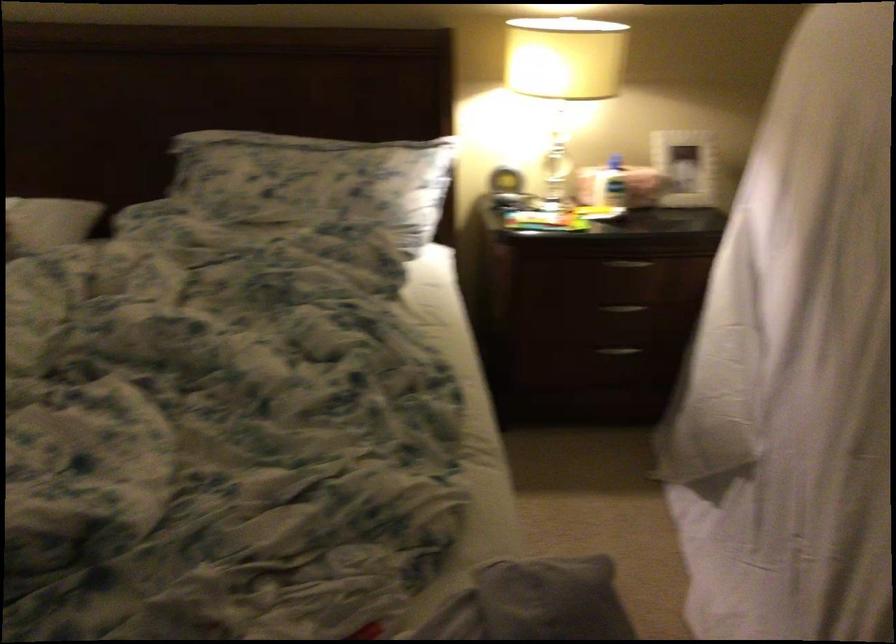
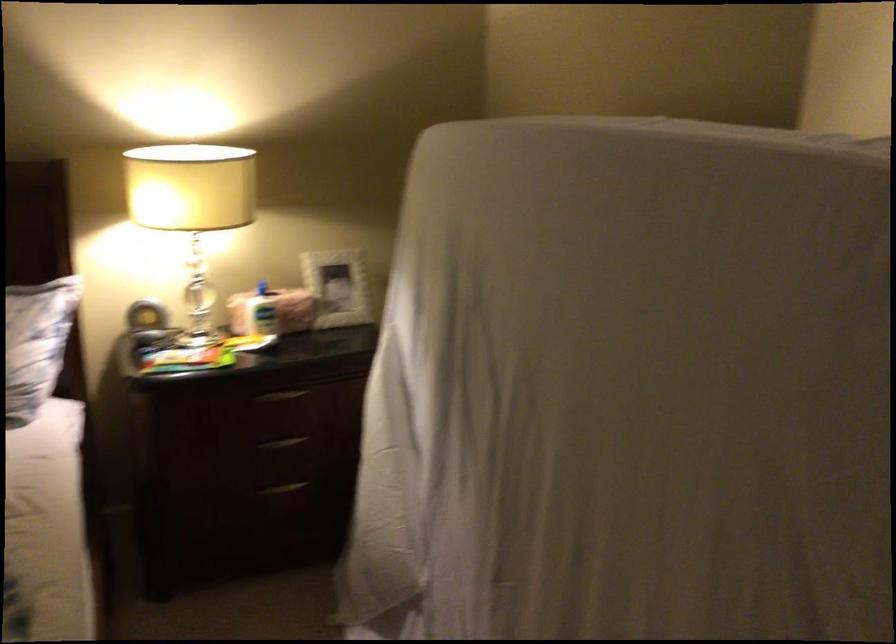
Locate, in the second image, the point that corresponds to point 618,346 in the first image.

(283, 488)